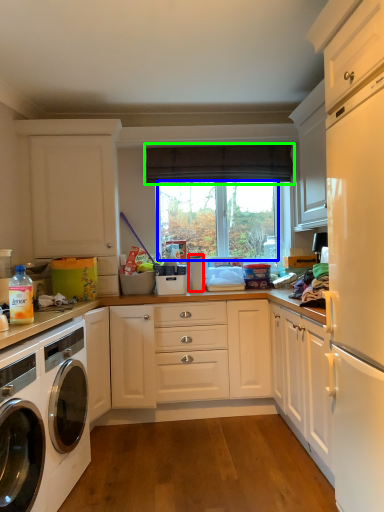
Question: Which object is positioned closest to appliance (highlighted by a red box)? Select from window screen (highlighted by a blue box) and curtain (highlighted by a green box).

Choices:
 (A) window screen
 (B) curtain

Answer: (A)